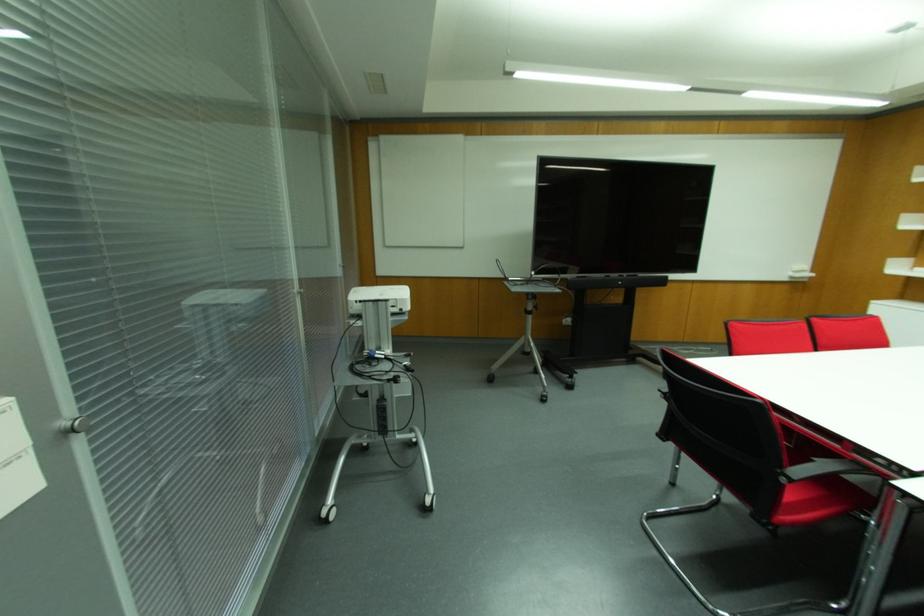
I want to click on black chair armrest, so click(822, 469).